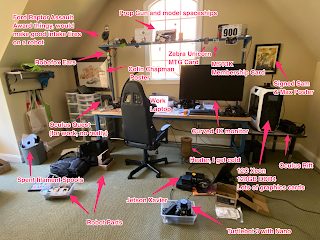
At what (x,y) coordinates should I click in order to perform the action: click on the back of office chair. Please return your answer as a coordinate pair (x, y). Image resolution: width=320 pixels, height=240 pixels. Looking at the image, I should click on (137, 128).